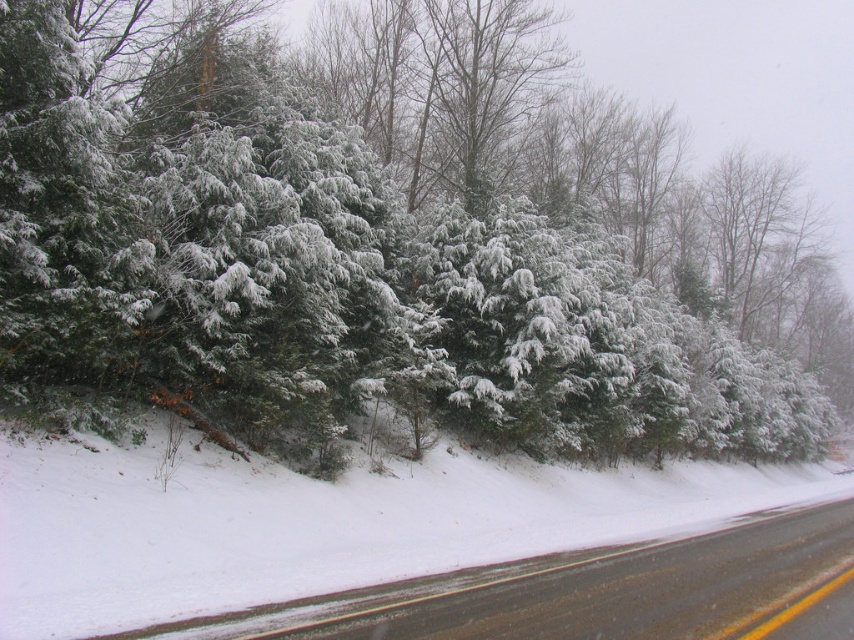
Question: Which point appears farthest from the camera in this image?

Choices:
 (A) (338, 67)
 (B) (651, 582)

Answer: (A)

Question: In this image, where is green matte evergreen trees at upper left located relative to black asphalt road at lower right?

Choices:
 (A) left
 (B) right

Answer: (B)

Question: Which of the following is the closest to the observer?

Choices:
 (A) black asphalt road at lower right
 (B) green matte evergreen trees at upper left

Answer: (A)

Question: Which point is farther to the camera?

Choices:
 (A) green matte evergreen trees at upper left
 (B) black asphalt road at lower right

Answer: (A)

Question: Can you confirm if green matte evergreen trees at upper left is positioned to the left of black asphalt road at lower right?

Choices:
 (A) no
 (B) yes

Answer: (A)

Question: From the image, what is the correct spatial relationship of green matte evergreen trees at upper left in relation to black asphalt road at lower right?

Choices:
 (A) above
 (B) below

Answer: (A)